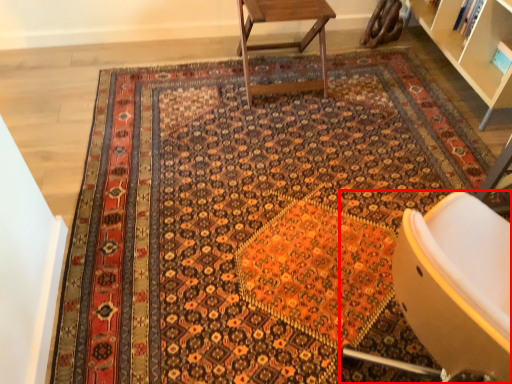
Question: From the image's perspective, where is chair (annotated by the red box) located in relation to table in the image?

Choices:
 (A) above
 (B) below

Answer: (B)